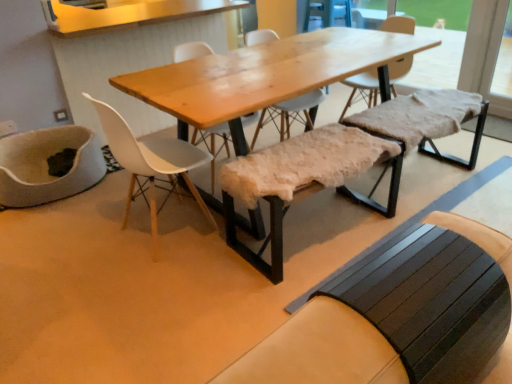
What is the approximate width of natural wood table at center?

It is 35.14 inches.

This screenshot has width=512, height=384. Describe the element at coordinates (281, 185) in the screenshot. I see `fuzzy sheepskin bench at center, marked as the second church bench in a back-to-front arrangement` at that location.

This screenshot has width=512, height=384. Describe the element at coordinates (151, 164) in the screenshot. I see `matte white chair at center` at that location.

What are the coordinates of `wooden armchair at upper center` in the screenshot? It's located at click(x=328, y=12).

Does fuzzy sheepskin bench at center, the 1th church bench in the back-to-front sequence, have a lesser height compared to natural wood table at center?

Indeed, fuzzy sheepskin bench at center, the 1th church bench in the back-to-front sequence, has a lesser height compared to natural wood table at center.

Is fuzzy sheepskin bench at center, the 1th church bench in the back-to-front sequence, thinner than natural wood table at center?

Indeed, fuzzy sheepskin bench at center, the 1th church bench in the back-to-front sequence, has a lesser width compared to natural wood table at center.

Is the depth of fuzzy sheepskin bench at center, which is the 3th church bench from front to back, less than that of natural wood table at center?

No, fuzzy sheepskin bench at center, which is the 3th church bench from front to back, is behind natural wood table at center.

Considering the points (361, 118) and (368, 377), which point is in front, point (361, 118) or point (368, 377)?

Point (368, 377)

Is fuzzy sheepskin bench at center, the 1th church bench in the back-to-front sequence, turned away from dark brown wooden bench at lower right, the 1th church bench when ordered from front to back?

fuzzy sheepskin bench at center, the 1th church bench in the back-to-front sequence, is not turned away from dark brown wooden bench at lower right, the 1th church bench when ordered from front to back.

In the image, is fuzzy sheepskin bench at center, the 1th church bench in the back-to-front sequence, positioned in front of or behind dark brown wooden bench at lower right, positioned as the third church bench in back-to-front order?

Visually, fuzzy sheepskin bench at center, the 1th church bench in the back-to-front sequence, is located behind dark brown wooden bench at lower right, positioned as the third church bench in back-to-front order.

Can you confirm if fuzzy sheepskin bench at center, which is the 3th church bench from front to back, is shorter than dark brown wooden bench at lower right, the 1th church bench when ordered from front to back?

Incorrect, the height of fuzzy sheepskin bench at center, which is the 3th church bench from front to back, does not fall short of that of dark brown wooden bench at lower right, the 1th church bench when ordered from front to back.

From the image's perspective, would you say dark brown wooden bench at lower right, positioned as the third church bench in back-to-front order, is shown under fuzzy sheepskin bench at center, the second church bench from the front?

Yes, from the image's perspective, dark brown wooden bench at lower right, positioned as the third church bench in back-to-front order, is below fuzzy sheepskin bench at center, the second church bench from the front.

Is dark brown wooden bench at lower right, the 1th church bench when ordered from front to back, oriented towards fuzzy sheepskin bench at center, marked as the second church bench in a back-to-front arrangement?

No.

You are a GUI agent. You are given a task and a screenshot of the screen. Output one action in this format:
    pyautogui.click(x=<x>, y=<y>)
    Task: Click on the church bench on the left of dark brown wooden bench at lower right, the 1th church bench when ordered from front to back
    
    Given the screenshot: What is the action you would take?
    pyautogui.click(x=281, y=185)

Is matte white chair at center a part of wooden armchair at upper center?

Definitely not — matte white chair at center is not inside wooden armchair at upper center.

Is wooden armchair at upper center taller than matte white chair at center?

No, wooden armchair at upper center is not taller than matte white chair at center.

Looking at this image, is natural wood table at center not within wooden armchair at upper center?

Yes, natural wood table at center is not within wooden armchair at upper center.

Looking at this image, is natural wood table at center bigger than wooden armchair at upper center?

Indeed, natural wood table at center has a larger size compared to wooden armchair at upper center.

Is natural wood table at center beside wooden armchair at upper center?

No, natural wood table at center is not touching wooden armchair at upper center.

How much distance is there between matte white chair at center and dark brown wooden bench at lower right, the 1th church bench when ordered from front to back?

matte white chair at center is 1.38 meters from dark brown wooden bench at lower right, the 1th church bench when ordered from front to back.

From the picture: What's the angular difference between matte white chair at center and dark brown wooden bench at lower right, the 1th church bench when ordered from front to back,'s facing directions?

matte white chair at center and dark brown wooden bench at lower right, the 1th church bench when ordered from front to back, are facing 1.41 degrees away from each other.

Can you confirm if matte white chair at center is taller than dark brown wooden bench at lower right, the 1th church bench when ordered from front to back?

Yes.

Who is smaller, matte white chair at center or dark brown wooden bench at lower right, the 1th church bench when ordered from front to back?

With smaller size is dark brown wooden bench at lower right, the 1th church bench when ordered from front to back.

Does point (182, 106) appear closer or farther from the camera than point (314, 178)?

Point (182, 106) is positioned farther from the camera compared to point (314, 178).

In the scene shown: How different are the orientations of natural wood table at center and fuzzy sheepskin bench at center, the second church bench from the front, in degrees?

The angle between the facing direction of natural wood table at center and the facing direction of fuzzy sheepskin bench at center, the second church bench from the front, is 2.69 degrees.

From the image's perspective, is natural wood table at center positioned above or below fuzzy sheepskin bench at center, marked as the second church bench in a back-to-front arrangement?

natural wood table at center is above fuzzy sheepskin bench at center, marked as the second church bench in a back-to-front arrangement.

From a real-world perspective, between natural wood table at center and fuzzy sheepskin bench at center, the second church bench from the front, who is vertically higher?

From a 3D spatial view, natural wood table at center is above.

The height and width of the screenshot is (384, 512). There is a fuzzy sheepskin bench at center, which is the 3th church bench from front to back. In order to click on table above it (from a real-world perspective) in this screenshot , I will do `click(264, 76)`.

Locate an element on the screen. This screenshot has height=384, width=512. the 1st church bench to the left of the fuzzy sheepskin bench at center, the 1th church bench in the back-to-front sequence, counting from the anchor's position is located at coordinates (401, 316).

Based on their spatial positions, is fuzzy sheepskin bench at center, the second church bench from the front, or dark brown wooden bench at lower right, the 1th church bench when ordered from front to back, closer to wooden armchair at upper center?

fuzzy sheepskin bench at center, the second church bench from the front, lies closer to wooden armchair at upper center than the other object.

Considering their positions, is fuzzy sheepskin bench at center, the 1th church bench in the back-to-front sequence, positioned further to matte white chair at center than dark brown wooden bench at lower right, positioned as the third church bench in back-to-front order?

dark brown wooden bench at lower right, positioned as the third church bench in back-to-front order, is positioned further to the anchor matte white chair at center.

When comparing their distances from dark brown wooden bench at lower right, the 1th church bench when ordered from front to back, does natural wood table at center or fuzzy sheepskin bench at center, marked as the second church bench in a back-to-front arrangement, seem closer?

fuzzy sheepskin bench at center, marked as the second church bench in a back-to-front arrangement, is positioned closer to the anchor dark brown wooden bench at lower right, the 1th church bench when ordered from front to back.

Looking at the image, which one is located closer to matte white chair at center, wooden armchair at upper center or natural wood table at center?

Among the two, natural wood table at center is located nearer to matte white chair at center.

From the picture: Looking at the image, which one is located further to fuzzy sheepskin bench at center, the 1th church bench in the back-to-front sequence, fuzzy sheepskin bench at center, marked as the second church bench in a back-to-front arrangement, or wooden armchair at upper center?

wooden armchair at upper center lies further to fuzzy sheepskin bench at center, the 1th church bench in the back-to-front sequence, than the other object.

Which object lies nearer to the anchor point natural wood table at center, matte white chair at center or dark brown wooden bench at lower right, the 1th church bench when ordered from front to back?

matte white chair at center is positioned closer to the anchor natural wood table at center.

Based on their spatial positions, is fuzzy sheepskin bench at center, the 1th church bench in the back-to-front sequence, or fuzzy sheepskin bench at center, marked as the second church bench in a back-to-front arrangement, closer to wooden armchair at upper center?

The object closer to wooden armchair at upper center is fuzzy sheepskin bench at center, the 1th church bench in the back-to-front sequence.

Looking at the image, which one is located closer to fuzzy sheepskin bench at center, marked as the second church bench in a back-to-front arrangement, matte white chair at center or wooden armchair at upper center?

matte white chair at center.

Image resolution: width=512 pixels, height=384 pixels. I want to click on table located between fuzzy sheepskin bench at center, marked as the second church bench in a back-to-front arrangement, and wooden armchair at upper center in the depth direction, so click(x=264, y=76).

The height and width of the screenshot is (384, 512). In order to click on table between matte white chair at center and fuzzy sheepskin bench at center, the 1th church bench in the back-to-front sequence, in the horizontal direction in this screenshot , I will do `click(264, 76)`.

Identify the location of chair between dark brown wooden bench at lower right, positioned as the third church bench in back-to-front order, and natural wood table at center from front to back. The width and height of the screenshot is (512, 384). (151, 164).

Locate an element on the screen. table between dark brown wooden bench at lower right, the 1th church bench when ordered from front to back, and fuzzy sheepskin bench at center, the 1th church bench in the back-to-front sequence, in the front-back direction is located at coordinates (264, 76).